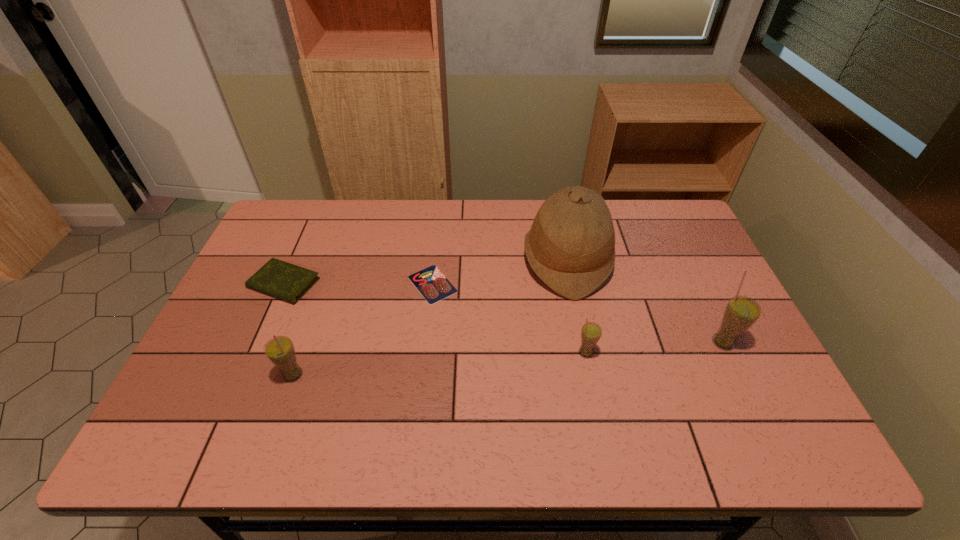
What are the coordinates of `the nearest object` in the screenshot? It's located at (280, 350).

What are the coordinates of `the nearest straw for drinking` in the screenshot? It's located at (280, 350).

Identify the location of the shortest straw for drinking. This screenshot has width=960, height=540. (591, 332).

Where is `the second straw for drinking from right to left`? Image resolution: width=960 pixels, height=540 pixels. the second straw for drinking from right to left is located at coordinates (591, 332).

You are a GUI agent. You are given a task and a screenshot of the screen. Output one action in this format:
    pyautogui.click(x=<x>, y=<y>)
    Task: Click on the rightmost straw for drinking
    Image resolution: width=960 pixels, height=540 pixels.
    Given the screenshot: What is the action you would take?
    pyautogui.click(x=741, y=312)

Identify the location of the rightmost object. (741, 312).

Find the location of a particular element. This screenshot has height=540, width=960. salami is located at coordinates (432, 284).

The height and width of the screenshot is (540, 960). I want to click on the shortest object, so click(x=432, y=284).

Locate an element on the screen. Image resolution: width=960 pixels, height=540 pixels. hat is located at coordinates (571, 245).

I want to click on diary, so click(x=277, y=278).